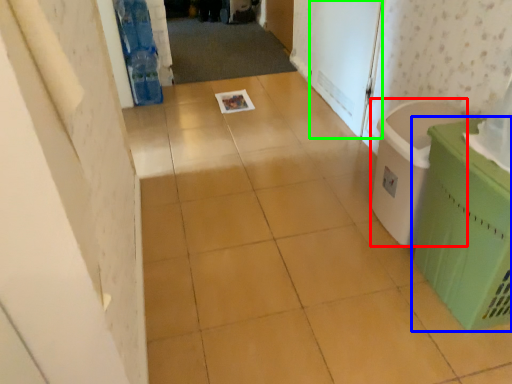
Question: Which is farther away from laundry basket (highlighted by a red box)? waste container (highlighted by a blue box) or screen door (highlighted by a green box)?

Choices:
 (A) waste container
 (B) screen door

Answer: (B)